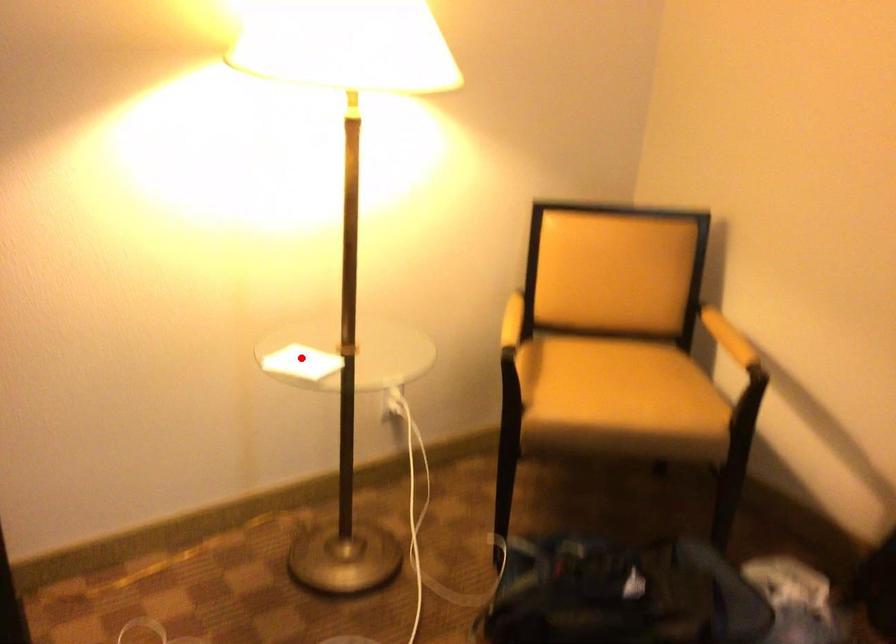
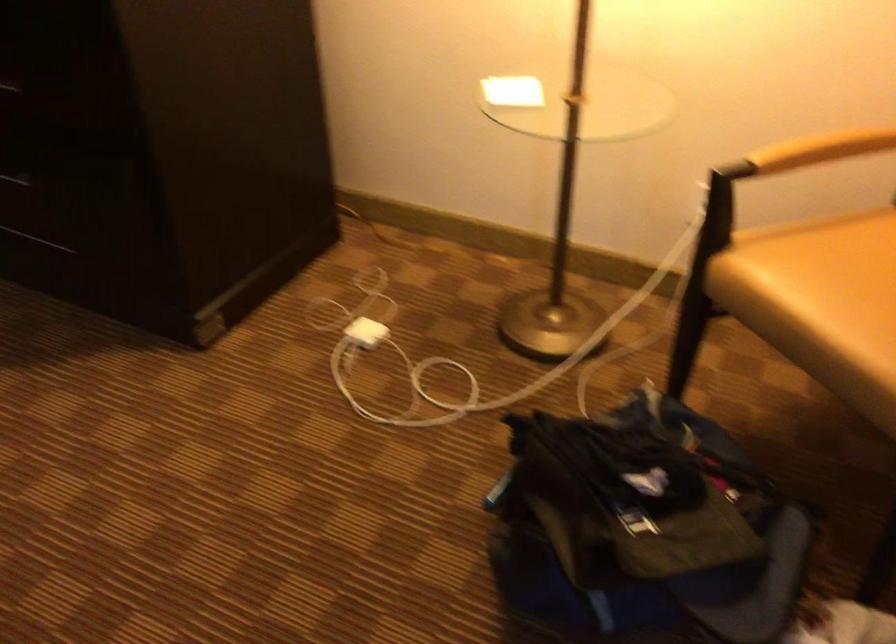
In the second image, find the point that corresponds to the highlighted location in the first image.

(513, 91)